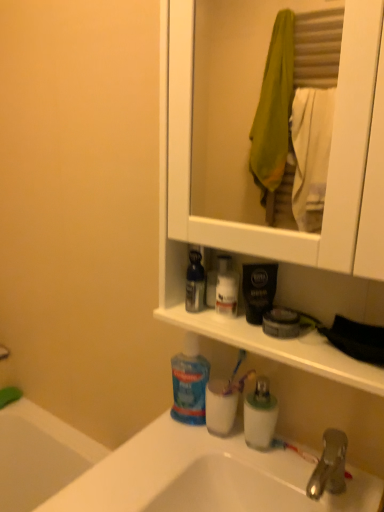
Question: Is blue glossy mouthwash at center, the second mouthwash viewed from the right, in front of or behind white matte cabinet at upper center in the image?

Choices:
 (A) front
 (B) behind

Answer: (B)

Question: Is blue glossy mouthwash at center, the second mouthwash viewed from the right, taller or shorter than white matte cabinet at upper center?

Choices:
 (A) tall
 (B) short

Answer: (B)

Question: Considering the real-world distances, which object is closest to the translucent plastic mouthwash at sink, acting as the 2th mouthwash starting from the top?

Choices:
 (A) blue glossy mouthwash at center, the second mouthwash viewed from the right
 (B) blue translucent mouthwash at center
 (C) white matte cabinet at upper center
 (D) translucent plastic toothbrush at lower center
 (E) white glossy lotion at center, which is counted as the 1th toiletry, starting from the left

Answer: (D)

Question: Which object is the closest to the white matte cabinet at upper center?

Choices:
 (A) translucent plastic mouthwash at sink, arranged as the second mouthwash when viewed from the left
 (B) translucent plastic toothbrush at lower center
 (C) white glossy lotion at center, the 2th toiletry from the right
 (D) translucent plastic soap dispenser at lower center, the first toiletry from the bottom
 (E) blue glossy mouthwash at center, the second mouthwash viewed from the right

Answer: (E)